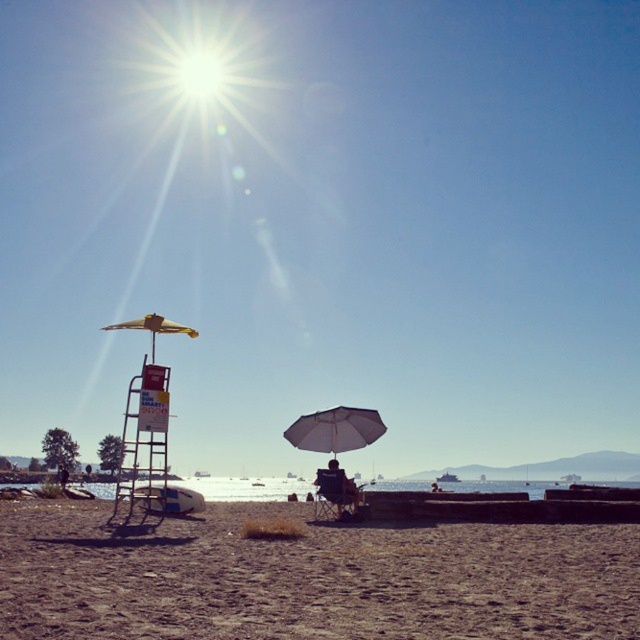
Question: Which of these objects is positioned closest to the dark blue fabric chair at center?

Choices:
 (A) brown sandy beach at lower center
 (B) white matte umbrella at center

Answer: (B)

Question: Which object is the farthest from the white matte umbrella at center?

Choices:
 (A) brown sandy beach at lower center
 (B) bright yellow umbrella at upper center
 (C) dark blue fabric chair at center

Answer: (B)

Question: Does white matte umbrella at center lie behind dark blue fabric chair at center?

Choices:
 (A) no
 (B) yes

Answer: (B)

Question: Is brown sandy beach at lower center positioned behind white matte umbrella at center?

Choices:
 (A) no
 (B) yes

Answer: (A)

Question: Observing the image, what is the correct spatial positioning of brown sandy beach at lower center in reference to white matte umbrella at center?

Choices:
 (A) left
 (B) right

Answer: (B)

Question: Which object appears farthest from the camera in this image?

Choices:
 (A) bright yellow umbrella at upper center
 (B) brown sandy beach at lower center
 (C) dark blue fabric chair at center
 (D) white matte umbrella at center

Answer: (D)